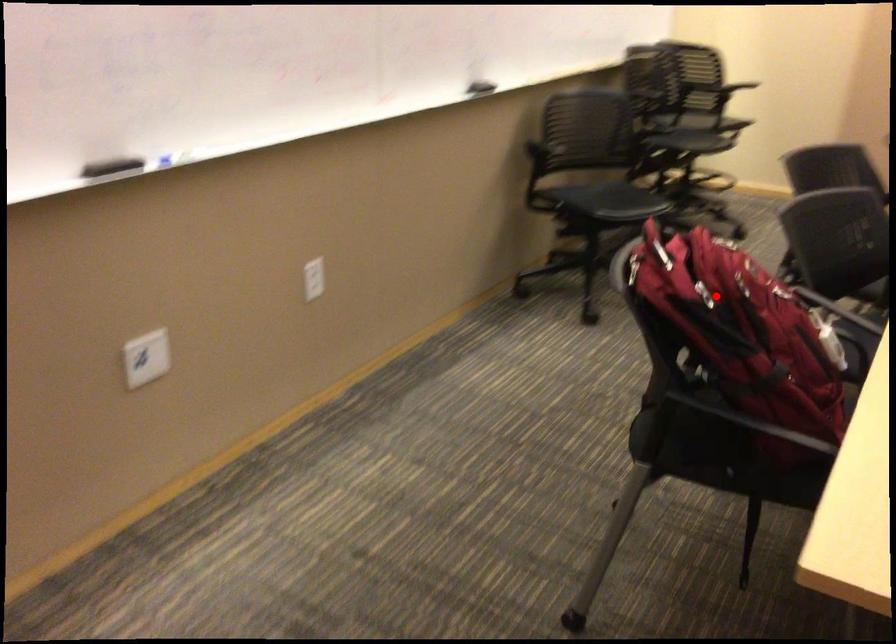
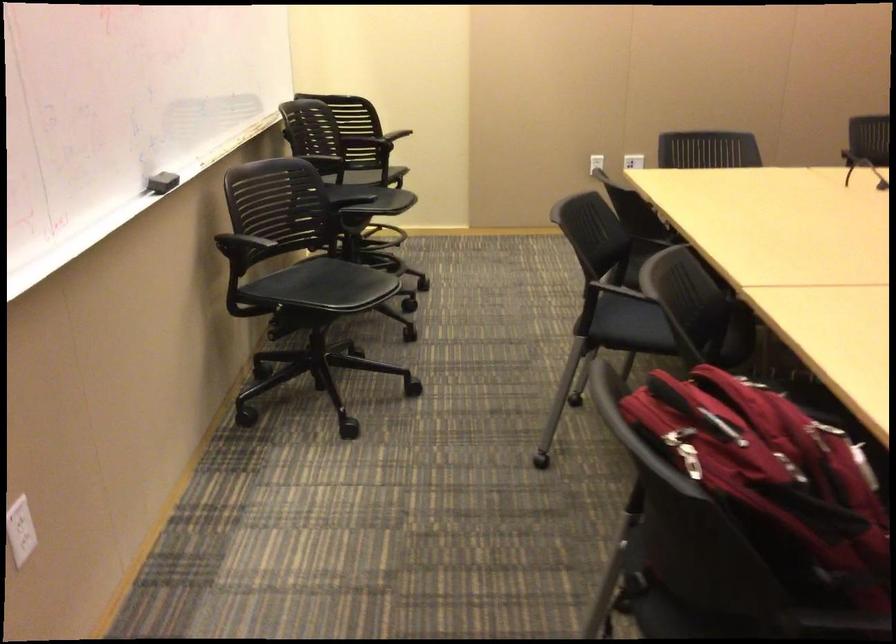
Question: I am providing you with two images of the same scene from different viewpoints. A red point is shown in image1. For the corresponding object point in image2, is it positioned nearer or farther from the camera?

Choices:
 (A) Nearer
 (B) Farther

Answer: (A)